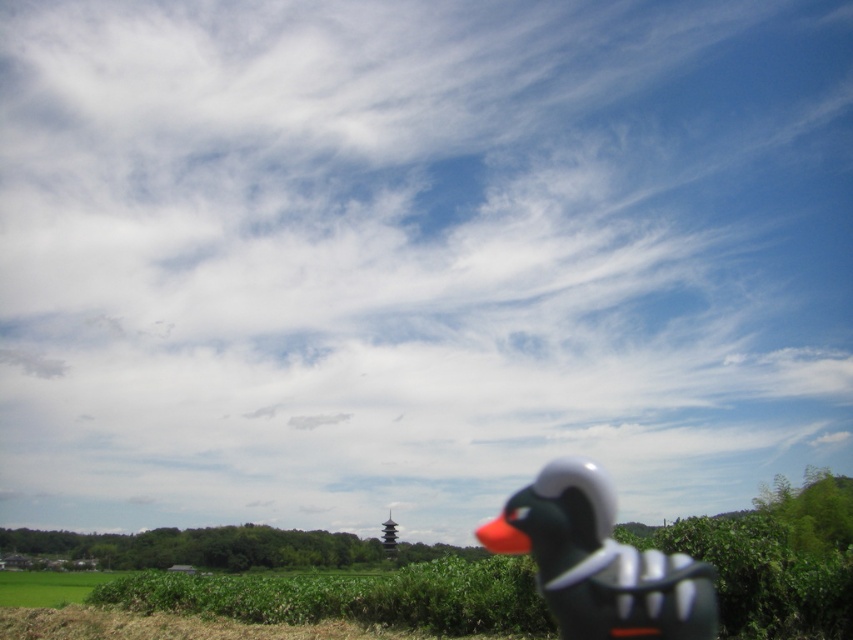
Measure the distance from matte black rubber duck at lower right to green grass at lower left.

They are 17.47 meters apart.

Between matte black rubber duck at lower right and green grass at lower left, which one has more height?

Standing taller between the two is matte black rubber duck at lower right.

Does point (613, 554) come farther from viewer compared to point (22, 600)?

That is False.

Identify the location of matte black rubber duck at lower right. The height and width of the screenshot is (640, 853). [x=599, y=561].